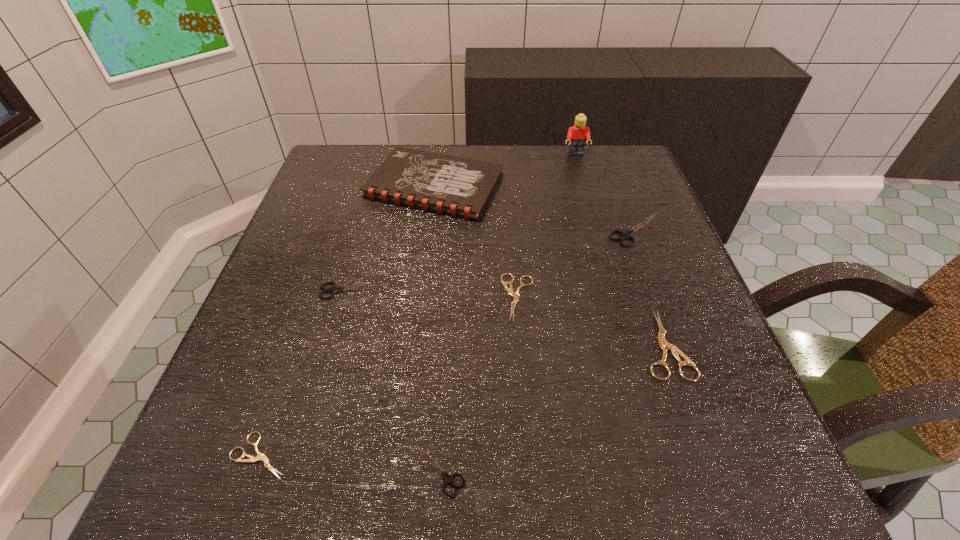
Locate an element on the screen. This screenshot has height=540, width=960. free space between the shortest shears and the biggest beige shears is located at coordinates (462, 400).

Locate an element on the screen. The width and height of the screenshot is (960, 540). vacant space that is in between the biggest black shears and the biggest beige shears is located at coordinates (650, 287).

Where is `unoccupied position between the tallest object and the second smallest black shears`? This screenshot has height=540, width=960. unoccupied position between the tallest object and the second smallest black shears is located at coordinates (464, 222).

I want to click on vacant point located between the second smallest black shears and the rightmost beige shears, so click(508, 318).

In order to click on object that is the seventh closest one to the rightmost black shears in this screenshot , I will do `click(260, 456)`.

Locate an element on the screen. the second closest object to the tallest object is located at coordinates (625, 235).

Point out which shears is positioned as the third nearest to the tallest shears. Please provide its 2D coordinates. Your answer should be formatted as a tuple, i.e. [(x, y)], where the tuple contains the x and y coordinates of a point satisfying the conditions above.

[(335, 289)]

Point out which shears is positioned as the nearest to the biggest beige shears. Please provide its 2D coordinates. Your answer should be formatted as a tuple, i.e. [(x, y)], where the tuple contains the x and y coordinates of a point satisfying the conditions above.

[(625, 235)]

The image size is (960, 540). In order to click on black shears that is the third closest to the Lego in this screenshot , I will do `click(449, 479)`.

Where is `black shears that is the closest one to the second black shears from left to right`? The width and height of the screenshot is (960, 540). black shears that is the closest one to the second black shears from left to right is located at coordinates (335, 289).